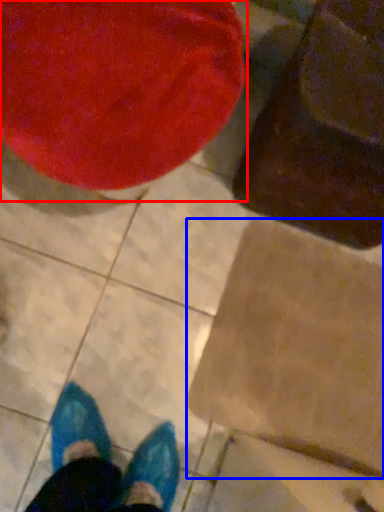
Question: Which point is closer to the camera, bean bag chair (highlighted by a red box) or cardboard box (highlighted by a blue box)?

Choices:
 (A) bean bag chair
 (B) cardboard box

Answer: (A)